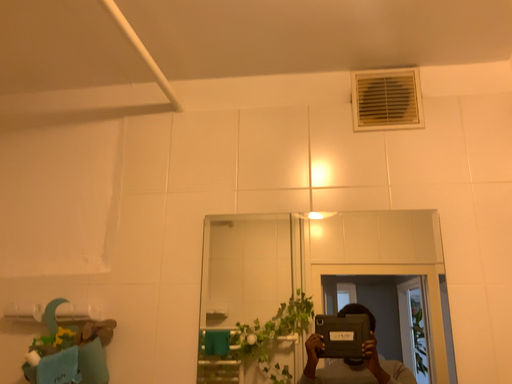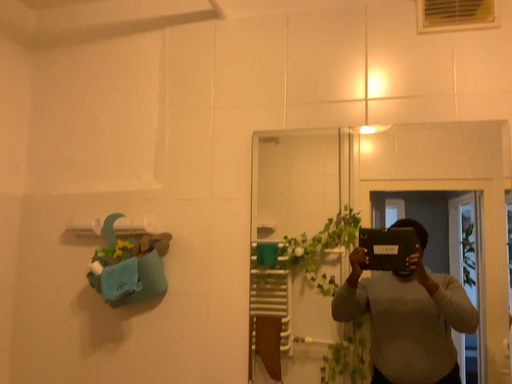
Question: How did the camera likely rotate when shooting the video?

Choices:
 (A) rotated upward
 (B) rotated downward

Answer: (B)